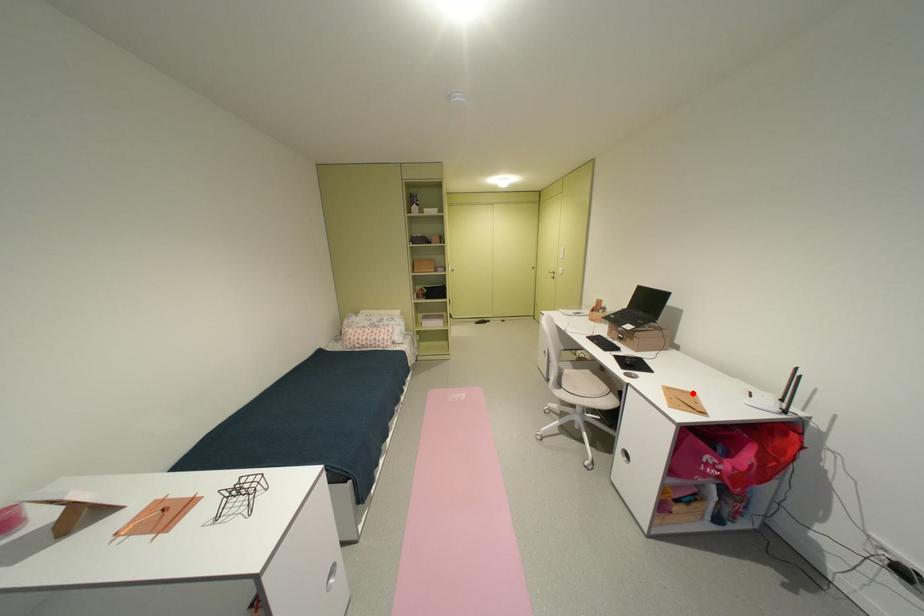
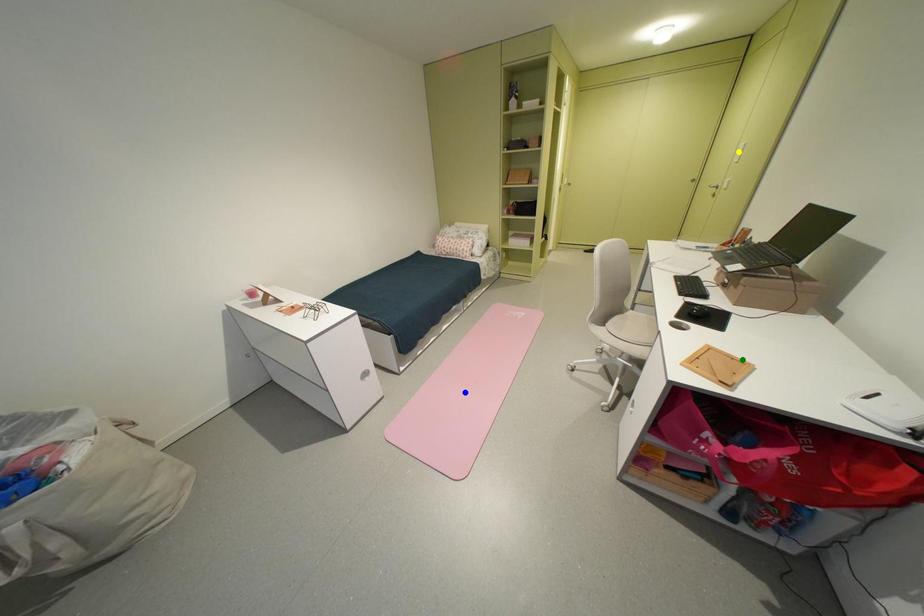
Question: I am providing you with two images of the same scene from different viewpoints. A red point is marked on the first image. You are given multiple points on the second image. Which point in image 2 is actually the same real-world point as the red point in image 1?

Choices:
 (A) yellow point
 (B) blue point
 (C) green point

Answer: (C)